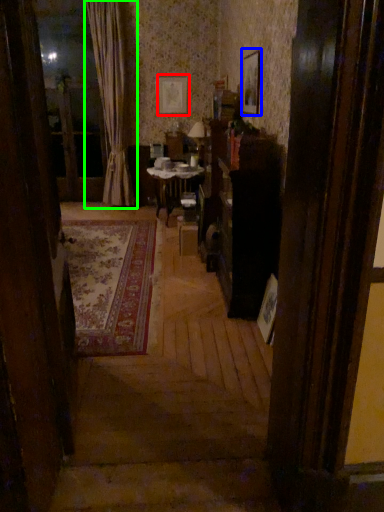
Question: Estimate the real-world distances between objects in this image. Which object is closer to picture frame (highlighted by a red box), picture frame (highlighted by a blue box) or curtain (highlighted by a green box)?

Choices:
 (A) picture frame
 (B) curtain

Answer: (B)